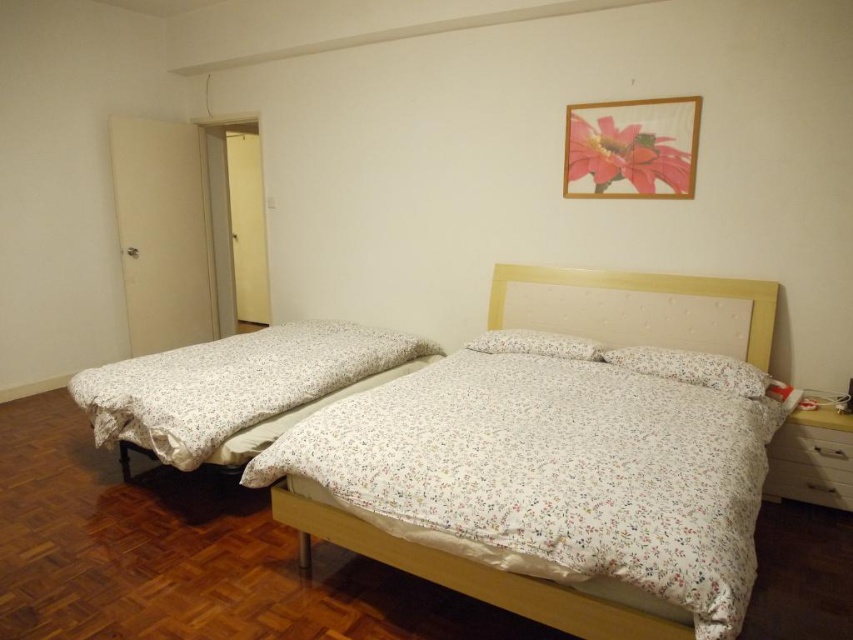
Question: Among these objects, which one is nearest to the camera?

Choices:
 (A) wooden bed frame at center
 (B) floral fabric pillow at center
 (C) white floral fabric blanket at left

Answer: (A)

Question: Is white floral fabric bed at center behind wooden bed frame at center?

Choices:
 (A) yes
 (B) no

Answer: (A)

Question: Among these objects, which one is farthest from the camera?

Choices:
 (A) white matte drawer at lower right
 (B) white floral fabric pillow at center
 (C) white floral fabric blanket at left

Answer: (B)

Question: Which object is closer to the camera taking this photo?

Choices:
 (A) white floral fabric pillow at center
 (B) white floral fabric bed at center
 (C) wooden bed frame at center
 (D) floral fabric pillow at center

Answer: (C)

Question: In this image, where is white floral fabric bed at center located relative to wooden bed frame at center?

Choices:
 (A) below
 (B) above

Answer: (B)

Question: In this image, where is white floral fabric bed at center located relative to floral fabric pillow at center?

Choices:
 (A) left
 (B) right

Answer: (A)